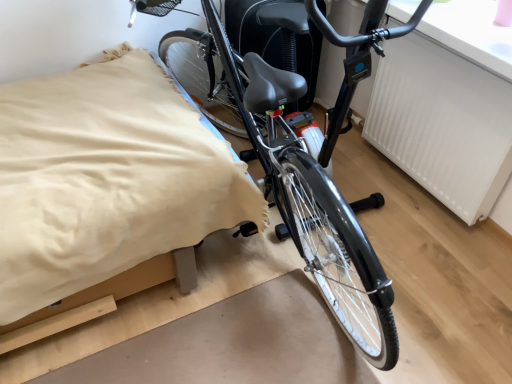
At what (x,y) coordinates should I click in order to perform the action: click on beige fabric bed at center. Please return your answer as a coordinate pair (x, y). The image size is (512, 384). Looking at the image, I should click on (106, 191).

Describe the element at coordinates (443, 123) in the screenshot. The image size is (512, 384). I see `white textured radiator at upper right` at that location.

At what (x,y) coordinates should I click in order to perform the action: click on beige fabric bed at center. Please return your answer as a coordinate pair (x, y). The height and width of the screenshot is (384, 512). Looking at the image, I should click on (106, 191).

Is white textured radiator at upper right situated inside beige fabric bed at center or outside?

A: white textured radiator at upper right is not inside beige fabric bed at center, it's outside.

Is white textured radiator at upper right placed right next to beige fabric bed at center?

No, white textured radiator at upper right is not making contact with beige fabric bed at center.

Considering the relative sizes of white textured radiator at upper right and beige fabric bed at center in the image provided, is white textured radiator at upper right bigger than beige fabric bed at center?

No.

Considering the sizes of objects beige fabric bed at center and shiny black bicycle at center in the image provided, who is bigger, beige fabric bed at center or shiny black bicycle at center?

Bigger between the two is shiny black bicycle at center.

From the image's perspective, between beige fabric bed at center and shiny black bicycle at center, which one is located above?

shiny black bicycle at center appears higher in the image.

Relative to shiny black bicycle at center, is beige fabric bed at center in front or behind?

In the image, beige fabric bed at center appears behind shiny black bicycle at center.

Considering the sizes of objects shiny black bicycle at center and beige fabric bed at center in the image provided, who is smaller, shiny black bicycle at center or beige fabric bed at center?

beige fabric bed at center.

From the image's perspective, is shiny black bicycle at center located beneath beige fabric bed at center?

No, from the image's perspective, shiny black bicycle at center is not beneath beige fabric bed at center.

Based on the photo, is shiny black bicycle at center turned away from beige fabric bed at center?

Correct, shiny black bicycle at center is looking away from beige fabric bed at center.

Is shiny black bicycle at center in front of beige fabric bed at center?

Yes, shiny black bicycle at center is closer to the viewer.

Is white textured radiator at upper right further to camera compared to shiny black bicycle at center?

Yes.

From the image's perspective, is white textured radiator at upper right positioned above or below shiny black bicycle at center?

From the image's perspective, white textured radiator at upper right appears above shiny black bicycle at center.

Is white textured radiator at upper right not inside shiny black bicycle at center?

Indeed, white textured radiator at upper right is completely outside shiny black bicycle at center.

In terms of size, does white textured radiator at upper right appear bigger or smaller than shiny black bicycle at center?

white textured radiator at upper right is smaller than shiny black bicycle at center.

Considering the relative sizes of beige fabric bed at center and white textured radiator at upper right in the image provided, is beige fabric bed at center wider than white textured radiator at upper right?

Yes, beige fabric bed at center is wider than white textured radiator at upper right.

From a real-world perspective, does beige fabric bed at center stand above white textured radiator at upper right?

Incorrect, from a real-world perspective, beige fabric bed at center is lower than white textured radiator at upper right.

Which point is more distant from viewer, (65, 137) or (480, 89)?

The point (480, 89) is behind.

Who is smaller, beige fabric bed at center or white textured radiator at upper right?

white textured radiator at upper right.

Is point (391, 351) positioned behind point (419, 145)?

No, it is in front of (419, 145).

Based on the photo, does shiny black bicycle at center have a greater height compared to white textured radiator at upper right?

Yes.

Which of these two, shiny black bicycle at center or white textured radiator at upper right, is smaller?

white textured radiator at upper right.

Looking at this image, from the image's perspective, does shiny black bicycle at center appear lower than white textured radiator at upper right?

Yes, from the image's perspective, shiny black bicycle at center is beneath white textured radiator at upper right.

Locate an element on the screen. The height and width of the screenshot is (384, 512). sheet that is below the white textured radiator at upper right (from the image's perspective) is located at coordinates (106, 191).

Locate an element on the screen. The width and height of the screenshot is (512, 384). sheet behind the shiny black bicycle at center is located at coordinates (106, 191).

Based on their spatial positions, is beige fabric bed at center or shiny black bicycle at center further from white textured radiator at upper right?

beige fabric bed at center is further to white textured radiator at upper right.

When comparing their distances from shiny black bicycle at center, does beige fabric bed at center or white textured radiator at upper right seem closer?

The object closer to shiny black bicycle at center is beige fabric bed at center.

Which object lies further to the anchor point beige fabric bed at center, shiny black bicycle at center or white textured radiator at upper right?

The object further to beige fabric bed at center is white textured radiator at upper right.

Estimate the real-world distances between objects in this image. Which object is further from white textured radiator at upper right, shiny black bicycle at center or beige fabric bed at center?

beige fabric bed at center.

Which object lies nearer to the anchor point beige fabric bed at center, white textured radiator at upper right or shiny black bicycle at center?

shiny black bicycle at center lies closer to beige fabric bed at center than the other object.

Which object lies further to the anchor point shiny black bicycle at center, white textured radiator at upper right or beige fabric bed at center?

white textured radiator at upper right.

This screenshot has height=384, width=512. I want to click on bicycle located between beige fabric bed at center and white textured radiator at upper right in the left-right direction, so click(316, 174).